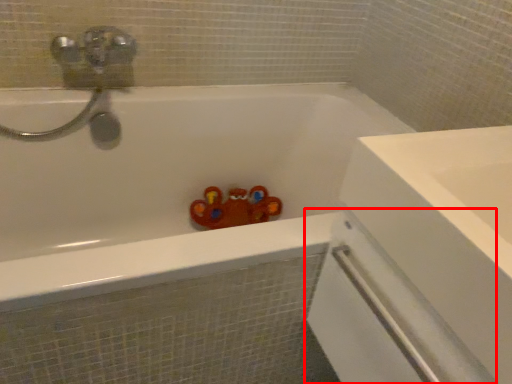
Question: Where is screen door (annotated by the red box) located in relation to bathtub in the image?

Choices:
 (A) left
 (B) right

Answer: (B)